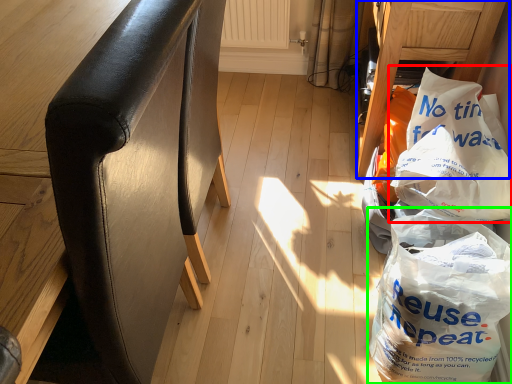
Question: Which object is positioned closest to plastic bag (highlighted by a red box)? Select from furniture (highlighted by a blue box) and plastic bag (highlighted by a green box).

Choices:
 (A) furniture
 (B) plastic bag

Answer: (B)